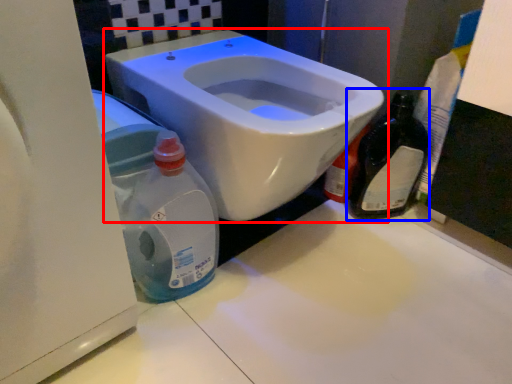
Question: Which object appears closest to the camera in this image, toilet (highlighted by a red box) or bottle (highlighted by a blue box)?

Choices:
 (A) toilet
 (B) bottle

Answer: (A)